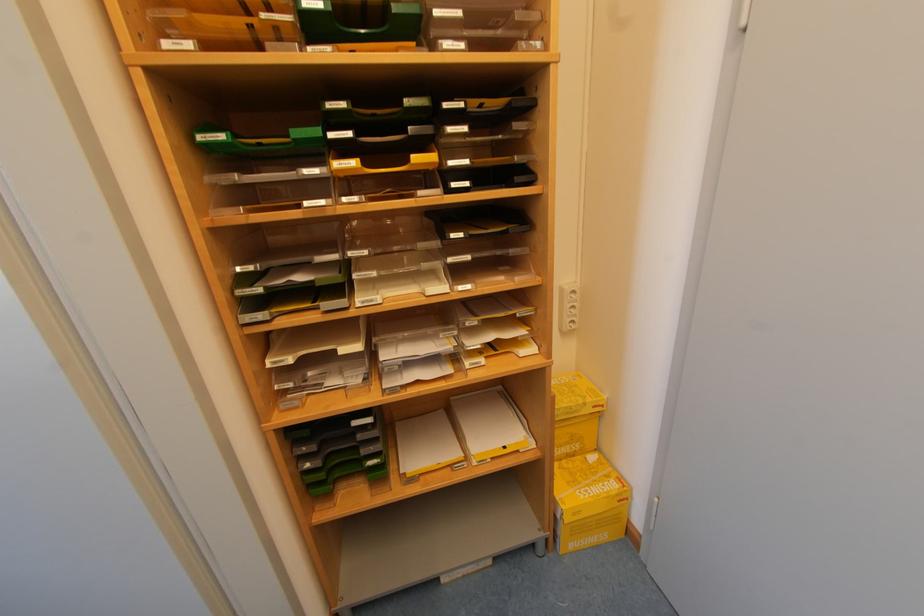
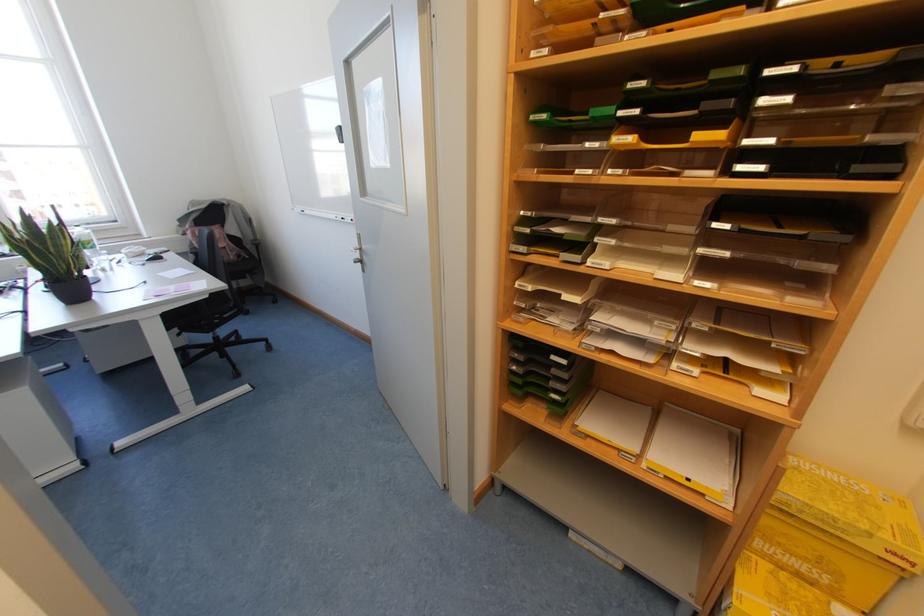
Where in the second image is the point corresponding to point 523,438 from the first image?

(720, 490)